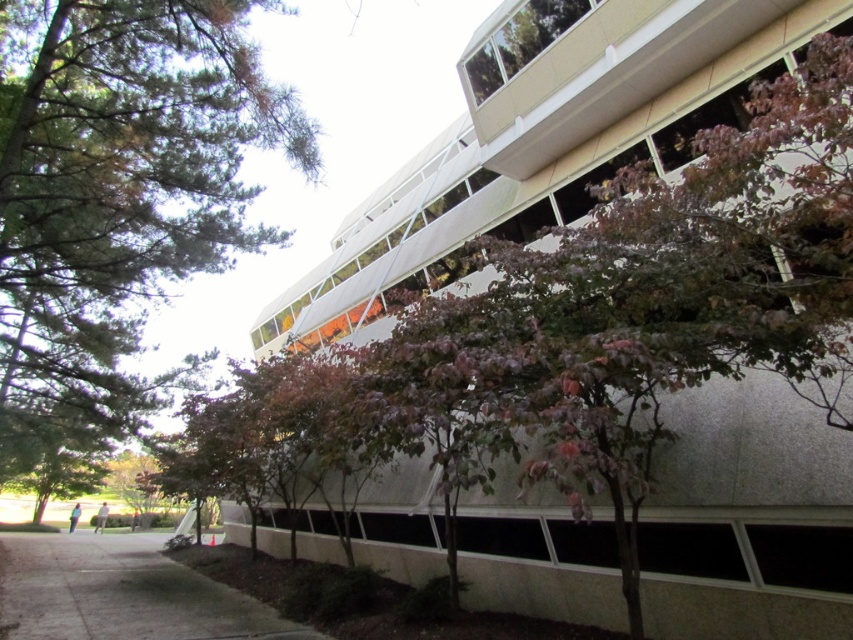
You are a landscape architect designing a garden around the modern building. You need to place a new bench that requires 3 meters of space. The bench must be placed either next to the green leafy tree at upper left or on the gray concrete pavement at lower left. Based on their widths, which location would you choose and why?

The green leafy tree at upper left is wider than the gray concrete pavement at lower left. Since the bench requires 3 meters of space, the green leafy tree at upper left would provide sufficient width for placement, making it the better choice.